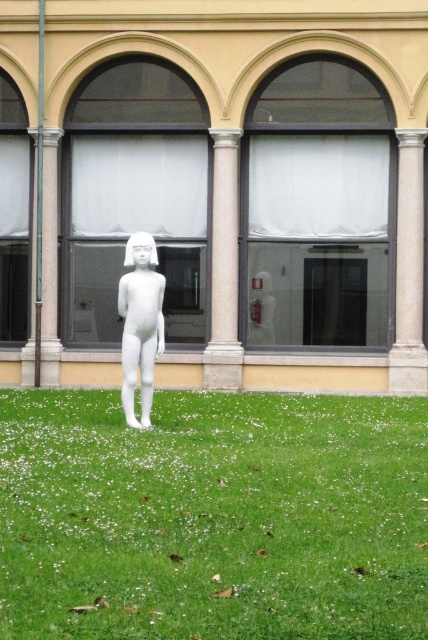
Is point (237, 260) positioned before point (38, 337)?

No, (237, 260) is behind (38, 337).

Between point (216, 262) and point (47, 221), which one is positioned behind?

Positioned behind is point (47, 221).

The width and height of the screenshot is (428, 640). Identify the location of white marble column at center. (223, 268).

Is point (418, 257) behind point (51, 232)?

No, (418, 257) is closer to viewer.

Where is `white marble pillar at center`? white marble pillar at center is located at coordinates (409, 268).

Is point (422, 156) positioned after point (45, 353)?

No, (422, 156) is in front of (45, 353).

Where is `white marble pillar at center`? The image size is (428, 640). white marble pillar at center is located at coordinates (409, 268).

Between green grass at center and white marble pillar at center, which one has less height?

green grass at center

Between green grass at center and white marble pillar at center, which one appears on the right side from the viewer's perspective?

white marble pillar at center

Which is in front, point (58, 406) or point (421, 140)?

Point (58, 406) is in front.

Identify the location of green grass at center. click(x=213, y=516).